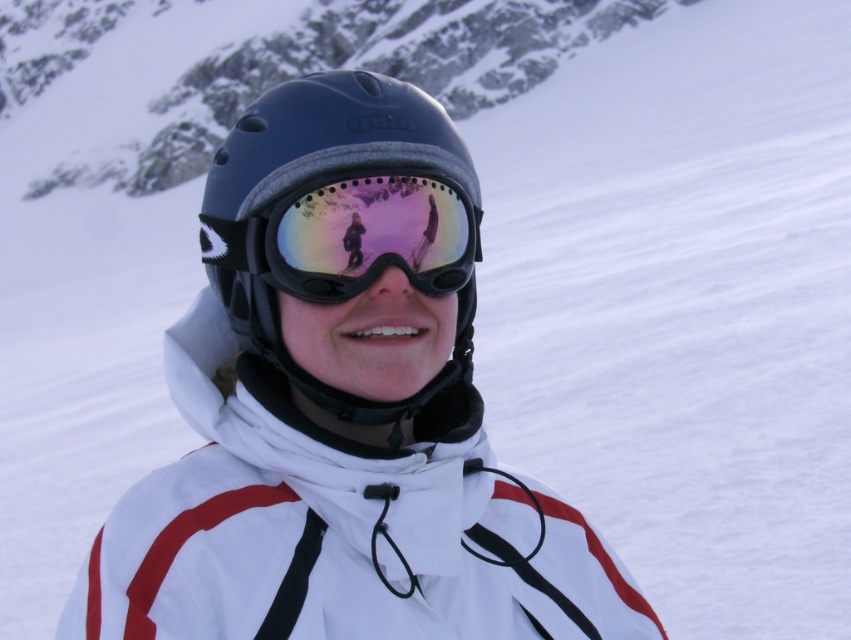
Which is below, matte black helmet at center or reflective plastic goggles at center?

matte black helmet at center is lower down.

Between matte black helmet at center and reflective plastic goggles at center, which one appears on the left side from the viewer's perspective?

From the viewer's perspective, matte black helmet at center appears more on the left side.

Find the location of a particular element. The width and height of the screenshot is (851, 640). matte black helmet at center is located at coordinates (347, 243).